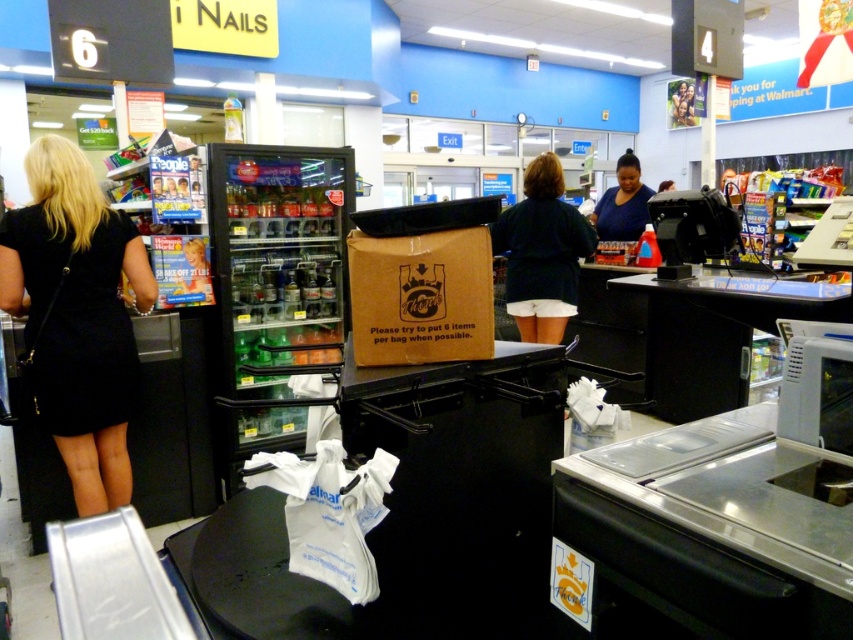
You are a Walmart employee and you see two shirts displayed at the center of the checkout area. The shirts are labeled as dark blue shirt at center and blue matte shirt at center. Which one is taller?

The dark blue shirt at center is much taller than the blue matte shirt at center.

You are a Walmart employee standing at the checkout counter and see two customers in dark blue shirt at center and blue matte shirt at center. Which customer is positioned to the left?

The dark blue shirt at center is positioned to the left of the blue matte shirt at center.

You are a Walmart employee who needs to place a new sign on the shopping cart. The sign must be placed above the brown cardboard box at center. Is the blue matte shirt at center in the way of placing the sign?

The brown cardboard box at center is shorter than blue matte shirt at center, so the blue matte shirt at center is taller. Therefore, the blue matte shirt at center may be in the way of placing the sign above the brown cardboard box at center.